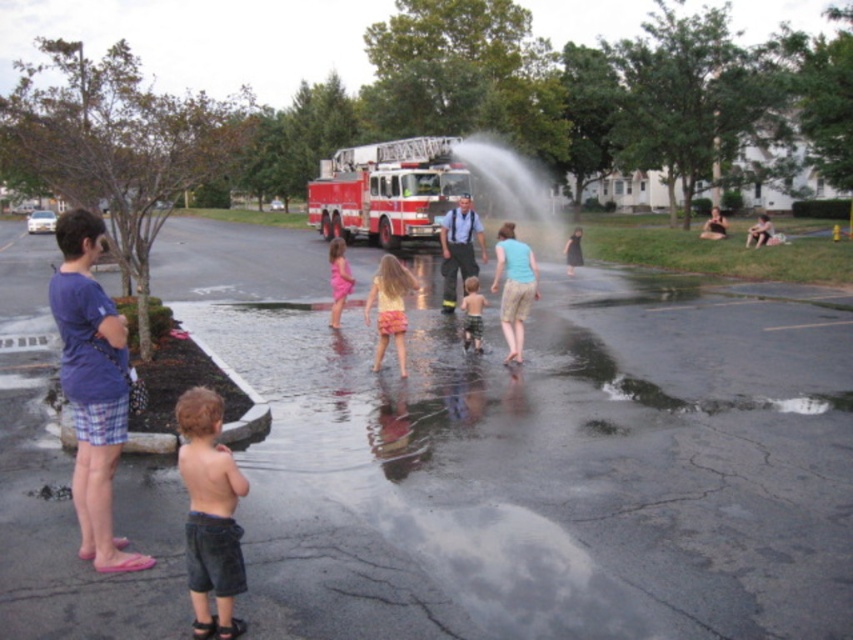
You are standing at the camera position and want to know the distance between the green plaid shorts at center and the matte pink dress at center. Can you estimate how far apart they are?

The green plaid shorts at center is 11.05 meters away from matte pink dress at center.

You are a photographer trying to capture a photo of both the denim shorts at lower left and the matte pink dress at center. Based on their positions, which one should you focus on first to ensure both are in the frame?

The denim shorts at lower left is located below the matte pink dress at center, so you should focus on the matte pink dress at center first to ensure both are in the frame.